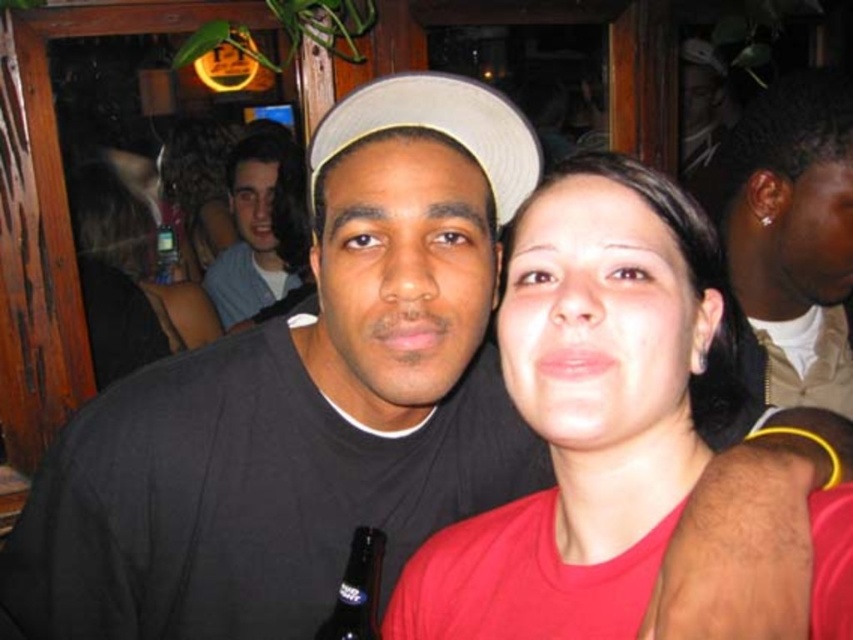
You are a photographer standing in front of the scene. You want to take a photo of both the smooth skin at center and the light blue denim shirt at upper left. Which object should you focus on first to ensure both are in focus?

You should focus on the light blue denim shirt at upper left first because it is closer to you than the smooth skin at center, which is further away. By focusing on the closer object, the depth of field may include both in focus.

You are a photographer adjusting your camera settings. You need to focus on both the smooth skin at center and the light blue denim shirt at upper left. Which object should you adjust the focus to first to ensure both are in focus?

The smooth skin at center is shorter than the light blue denim shirt at upper left, so you should focus on the light blue denim shirt at upper left first because it is farther away, ensuring the depth of field captures both subjects properly.